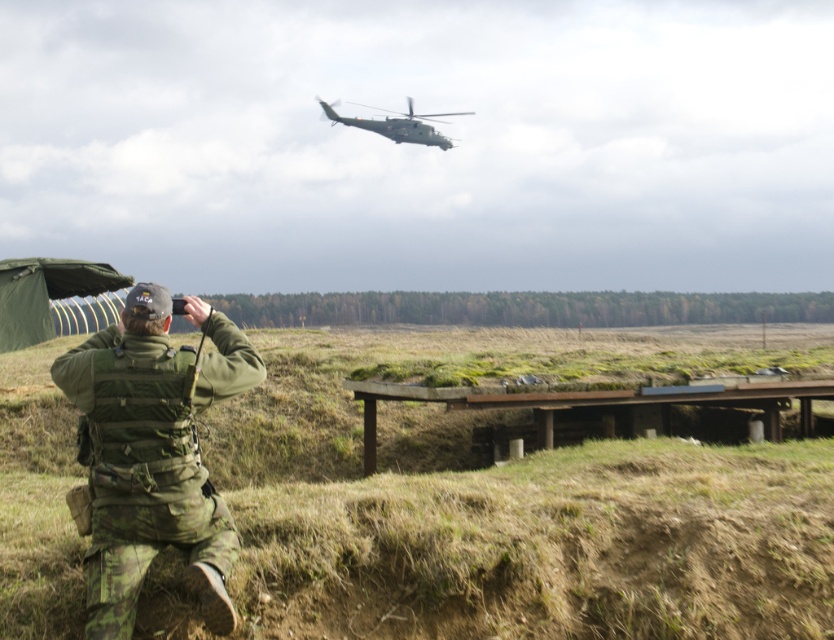
Which is more to the left, green camouflage field at lower left or green matte helicopter at upper center?

green matte helicopter at upper center is more to the left.

Identify the location of green camouflage field at lower left. (521, 499).

Does point (576, 512) come in front of point (398, 116)?

Yes, it is in front of point (398, 116).

Where is `green camouflage field at lower left`? The image size is (834, 640). green camouflage field at lower left is located at coordinates (521, 499).

Is green camouflage field at lower left taller than camouflage fabric uniform at lower left?

Yes.

Between green camouflage field at lower left and camouflage fabric uniform at lower left, which one appears on the right side from the viewer's perspective?

green camouflage field at lower left

Is point (644, 497) in front of point (138, 332)?

No, (644, 497) is further to viewer.

Locate an element on the screen. This screenshot has width=834, height=640. green camouflage field at lower left is located at coordinates (521, 499).

Does camouflage fabric uniform at lower left have a greater height compared to green matte helicopter at upper center?

No, camouflage fabric uniform at lower left is not taller than green matte helicopter at upper center.

Can you confirm if camouflage fabric uniform at lower left is smaller than green matte helicopter at upper center?

Correct, camouflage fabric uniform at lower left occupies less space than green matte helicopter at upper center.

Who is more distant from viewer, (219, 499) or (409, 100)?

Positioned behind is point (409, 100).

Locate an element on the screen. This screenshot has height=640, width=834. camouflage fabric uniform at lower left is located at coordinates (153, 452).